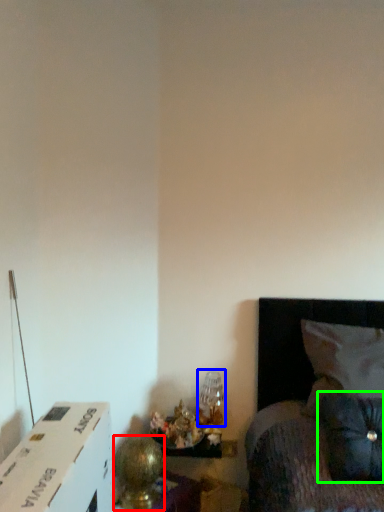
Question: Considering the real-world distances, which object is closest to table lamp (highlighted by a red box)? table lamp (highlighted by a blue box) or pillow (highlighted by a green box).

Choices:
 (A) table lamp
 (B) pillow

Answer: (A)